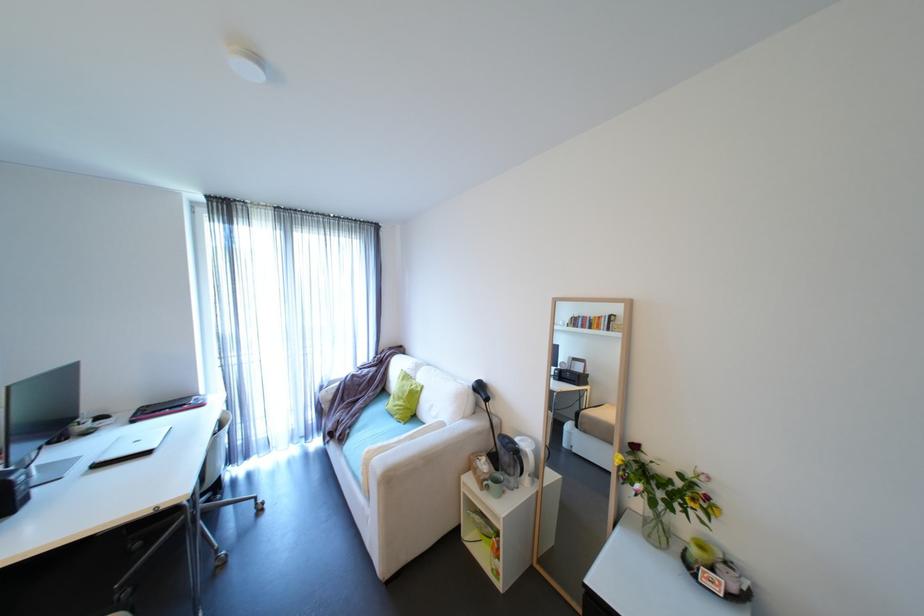
Image resolution: width=924 pixels, height=616 pixels. Describe the element at coordinates (372, 430) in the screenshot. I see `the sofa sitting surface` at that location.